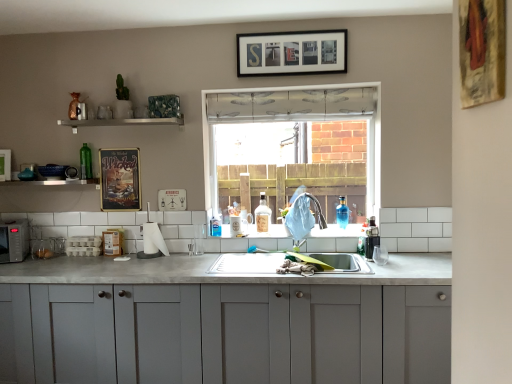
This screenshot has height=384, width=512. In order to click on vacant region below black matte picture frame at upper center, the 2th picture frame from the right (from a real-world perspective) in this screenshot , I will do `click(304, 251)`.